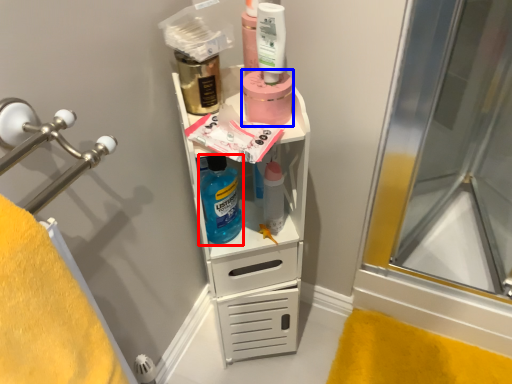
Question: Which object appears farthest to the camera in this image, cleaning product (highlighted by a red box) or product (highlighted by a blue box)?

Choices:
 (A) cleaning product
 (B) product

Answer: (A)